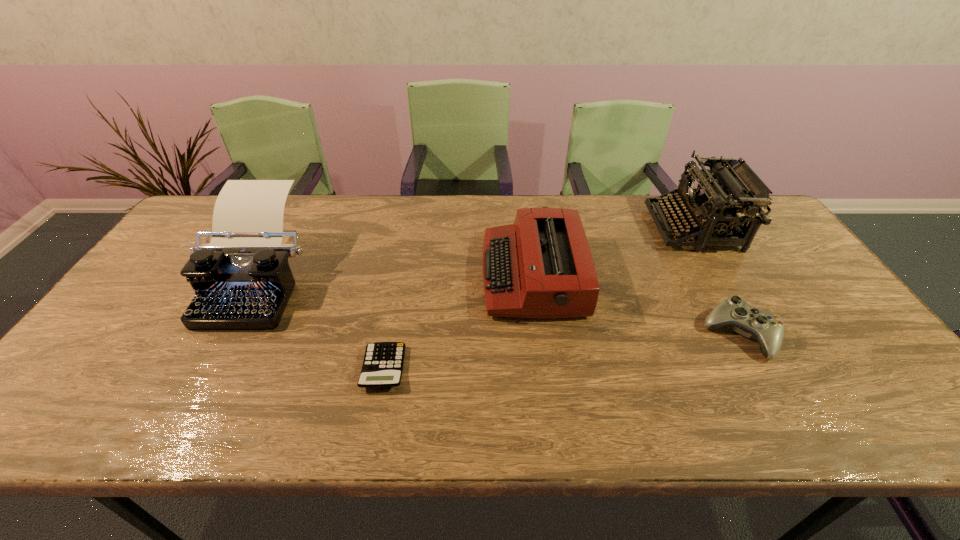
I want to click on empty space between the rightmost typewriter and the control, so click(x=717, y=281).

Where is `vacant space in between the control and the rightmost typewriter`? vacant space in between the control and the rightmost typewriter is located at coordinates (717, 281).

Locate an element on the screen. vacant space that is in between the leftmost typewriter and the rightmost typewriter is located at coordinates (474, 252).

Locate an element on the screen. object that stands as the second closest to the second typewriter from left to right is located at coordinates (731, 187).

Select which object is the fourth closest to the fourth object from right to left. Please provide its 2D coordinates. Your answer should be formatted as a tuple, i.e. [(x, y)], where the tuple contains the x and y coordinates of a point satisfying the conditions above.

[(731, 187)]

I want to click on typewriter that is the nearest to the rightmost typewriter, so click(x=541, y=266).

Identify which typewriter is the second closest to the second object from left to right. Please provide its 2D coordinates. Your answer should be formatted as a tuple, i.e. [(x, y)], where the tuple contains the x and y coordinates of a point satisfying the conditions above.

[(242, 280)]

At what (x,y) coordinates should I click in order to perform the action: click on vacant space that satisfies the following two spatial constraints: 1. on the typing side of the third object from right to left; 2. on the back side of the control. Please return your answer as a coordinate pair (x, y). Looking at the image, I should click on (540, 335).

This screenshot has width=960, height=540. I want to click on free space that satisfies the following two spatial constraints: 1. on the back side of the control; 2. on the left side of the shortest object, so click(x=390, y=335).

Where is `free space that satisfies the following two spatial constraints: 1. on the keys of the second shortest object; 2. on the right side of the leftmost object`? free space that satisfies the following two spatial constraints: 1. on the keys of the second shortest object; 2. on the right side of the leftmost object is located at coordinates (225, 335).